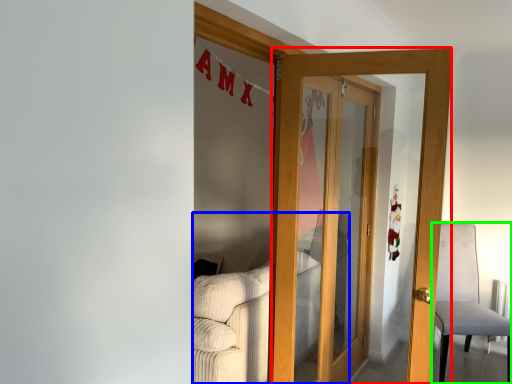
Question: Based on their relative distances, which object is farther from door (highlighted by a red box)? Choose from couch (highlighted by a blue box) and chair (highlighted by a green box).

Choices:
 (A) couch
 (B) chair

Answer: (B)